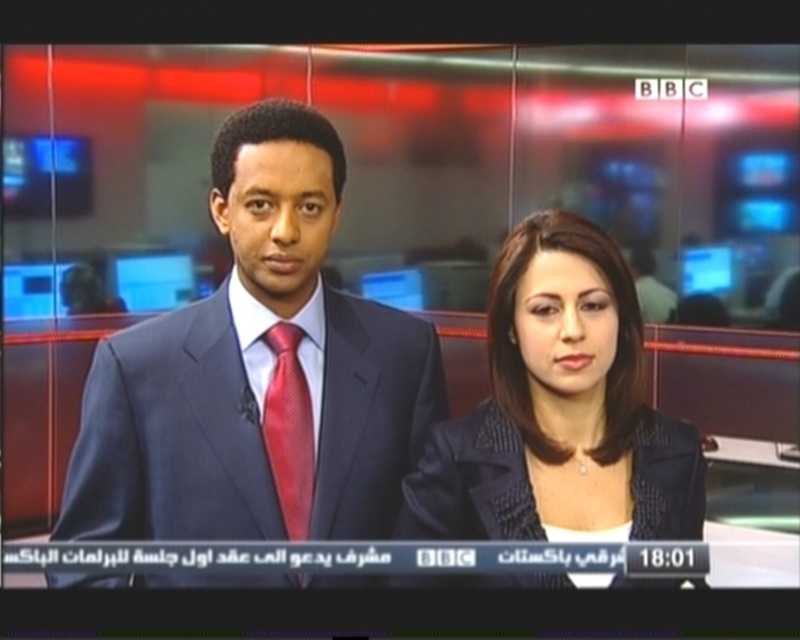
Which is below, matte black blazer at center or shiny silk tie at center?

shiny silk tie at center is below.

Which is in front, point (424, 516) or point (284, 369)?

Point (284, 369) is in front.

Image resolution: width=800 pixels, height=640 pixels. I want to click on matte black blazer at center, so click(560, 408).

Between matte black suit at center and matte black blazer at center, which one is positioned lower?

Positioned lower is matte black suit at center.

You are a GUI agent. You are given a task and a screenshot of the screen. Output one action in this format:
    pyautogui.click(x=<x>, y=<y>)
    Task: Click on the matte black suit at center
    Image resolution: width=800 pixels, height=640 pixels.
    Given the screenshot: What is the action you would take?
    pyautogui.click(x=258, y=372)

The height and width of the screenshot is (640, 800). Identify the location of matte black suit at center. (258, 372).

Which is behind, point (138, 413) or point (288, 387)?

The point (288, 387) is more distant.

Who is shorter, matte black suit at center or shiny silk tie at center?

With less height is shiny silk tie at center.

Is point (426, 380) more distant than point (302, 371)?

Yes, it is.

Locate an element on the screen. matte black suit at center is located at coordinates (258, 372).